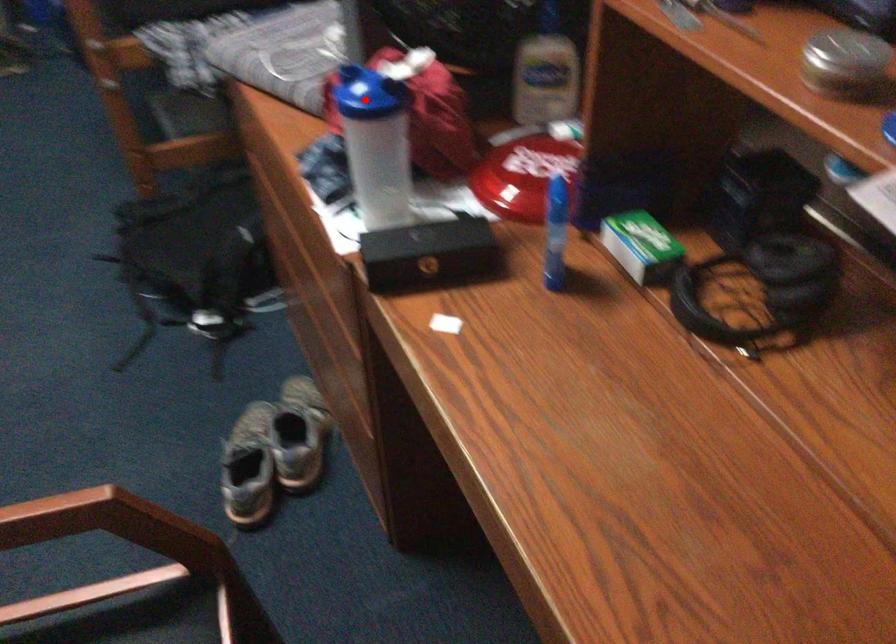
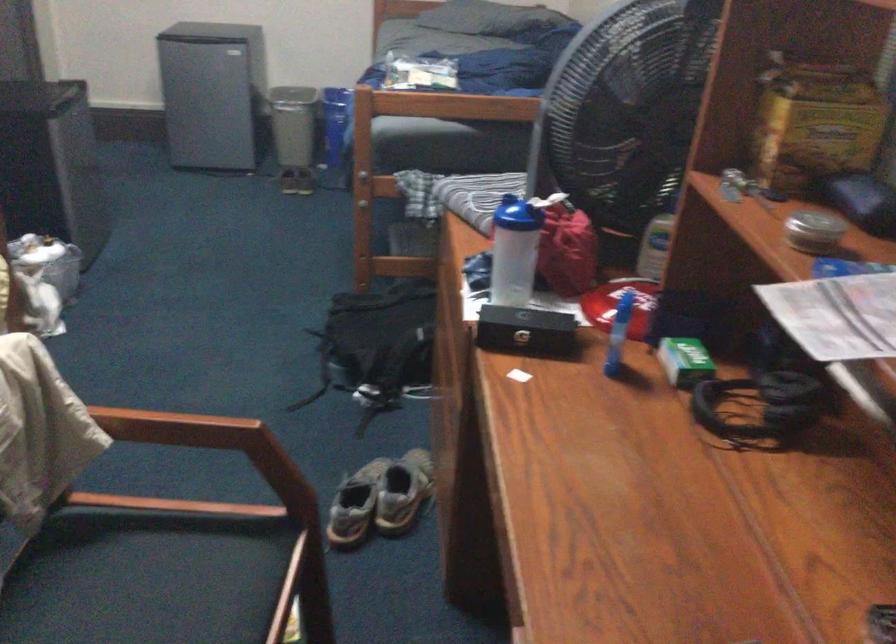
Question: A red point is marked in image1. In image2, is the corresponding 3D point closer to the camera or farther? Reply with the corresponding letter.

Choices:
 (A) The corresponding 3D point is closer.
 (B) The corresponding 3D point is farther.

Answer: (B)